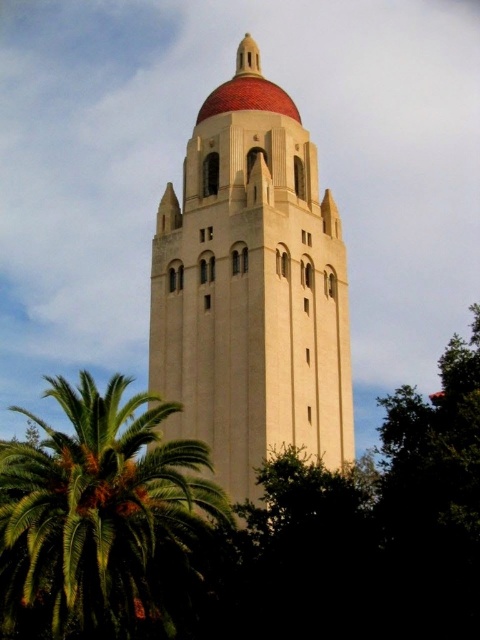
In the scene shown: You are a photographer planning to capture a photo of the beige stone tower at center and the green leafy palm at lower left. Based on their sizes, which object should you focus on to ensure it fills the frame more prominently?

The beige stone tower at center is much taller than the green leafy palm at lower left, so focusing on the beige stone tower at center will fill the frame more prominently.

You are standing at a certain distance from the beige stone tower at center. If you want to take a photo of the tower that includes the entire structure without cropping any part of it, what is the minimum distance you should maintain from the tower?

The minimum distance you should maintain from the beige stone tower at center is 54.33 meters to ensure the entire structure fits in the photo without cropping.

You are standing in front of the beige stone tower at center and want to take a photo that includes both the tower and the green leafy palm at lower left. Considering their widths, which object should you position closer to the camera to ensure both fit in the frame?

The beige stone tower at center has a lesser width compared to the green leafy palm at lower left. To ensure both fit in the frame, position the green leafy palm at lower left closer to the camera since it is wider and requires more space.